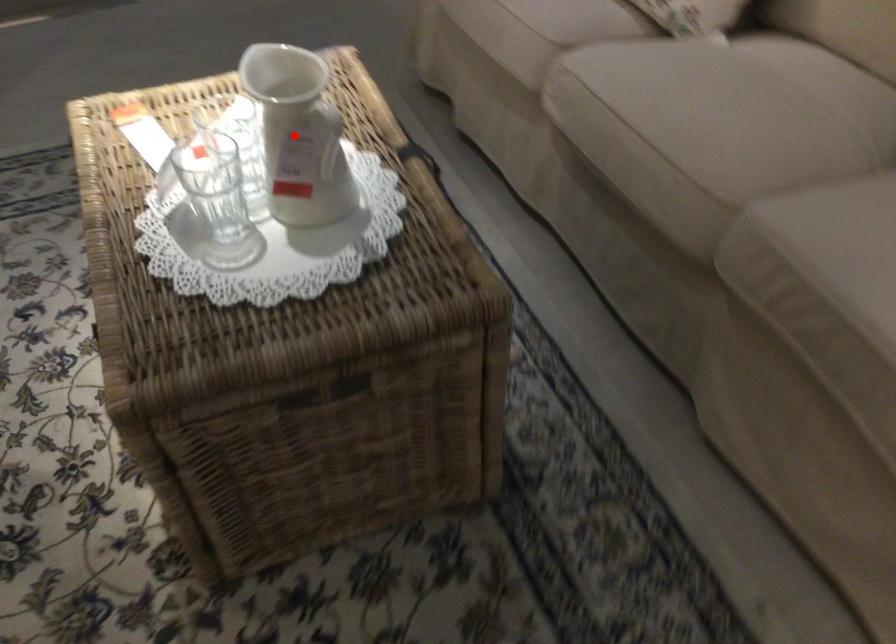
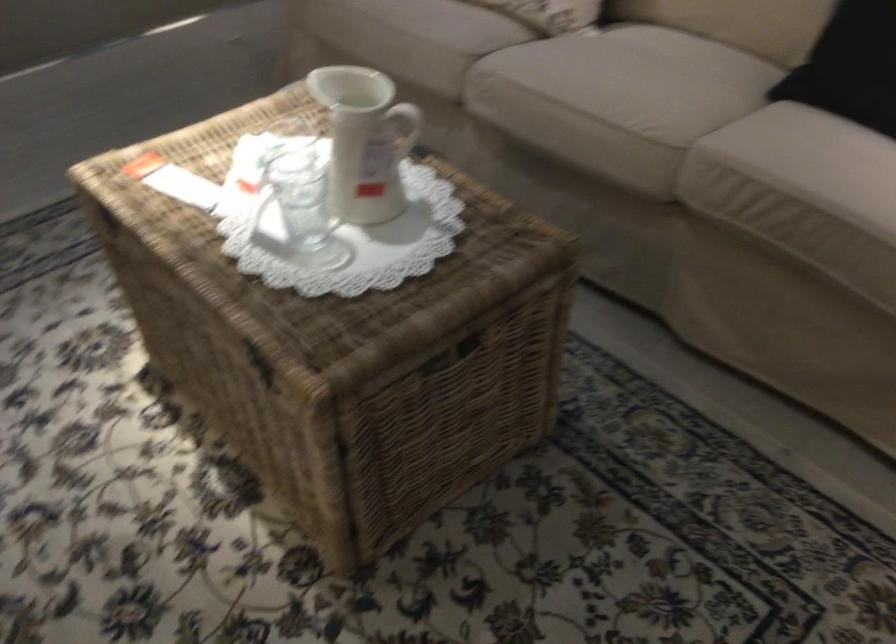
Find the pixel in the second image that matches the highlighted location in the first image.

(365, 140)